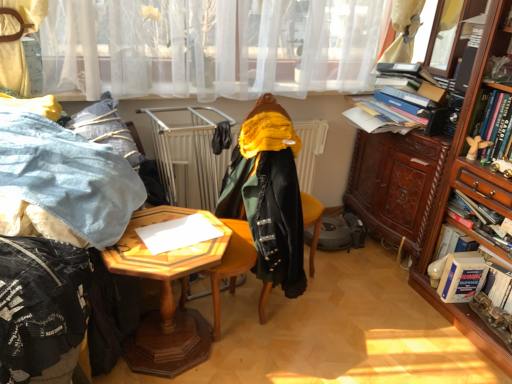
Question: Is wooden hexagonal table at center taller or shorter than velvet black coat at center?

Choices:
 (A) tall
 (B) short

Answer: (B)

Question: From a real-world perspective, is wooden hexagonal table at center physically located above or below velvet black coat at center?

Choices:
 (A) below
 (B) above

Answer: (A)

Question: Which of these objects is positioned closest to the wooden hexagonal table at center?

Choices:
 (A) hardcover book at right, which is the 4th book in bottom-to-top order
 (B) wooden cabinet at right, marked as the second cabinetry in a back-to-front arrangement
 (C) dark brown wood cabinet at right, placed as the first cabinetry when sorted from back to front
 (D) denim at left
 (E) hardcover book at right, the 3th book from the bottom

Answer: (D)

Question: Based on their relative distances, which object is farther from the wooden hexagonal table at center?

Choices:
 (A) dark brown wood cabinet at right, arranged as the 2th cabinetry when viewed from the front
 (B) white cardboard book at right, the 2th book positioned from the bottom
 (C) hardcover book at right, acting as the 2th book starting from the top
 (D) velvet-like green coat at center
 (E) hardcover book at right, which is the 4th book in bottom-to-top order

Answer: (E)